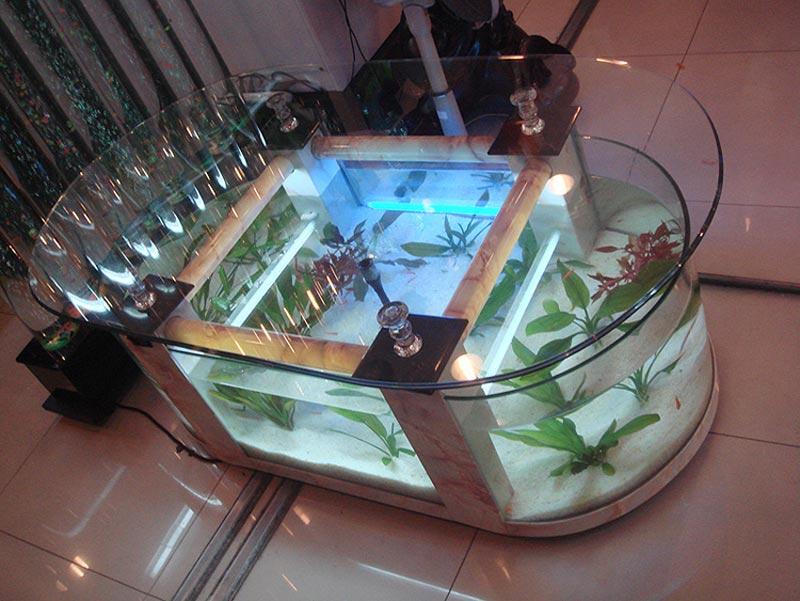
You are a GUI agent. You are given a task and a screenshot of the screen. Output one action in this format:
    pyautogui.click(x=<x>, y=<y>)
    Task: Click on the fake marble
    
    Given the screenshot: What is the action you would take?
    pyautogui.click(x=452, y=463), pyautogui.click(x=186, y=407)